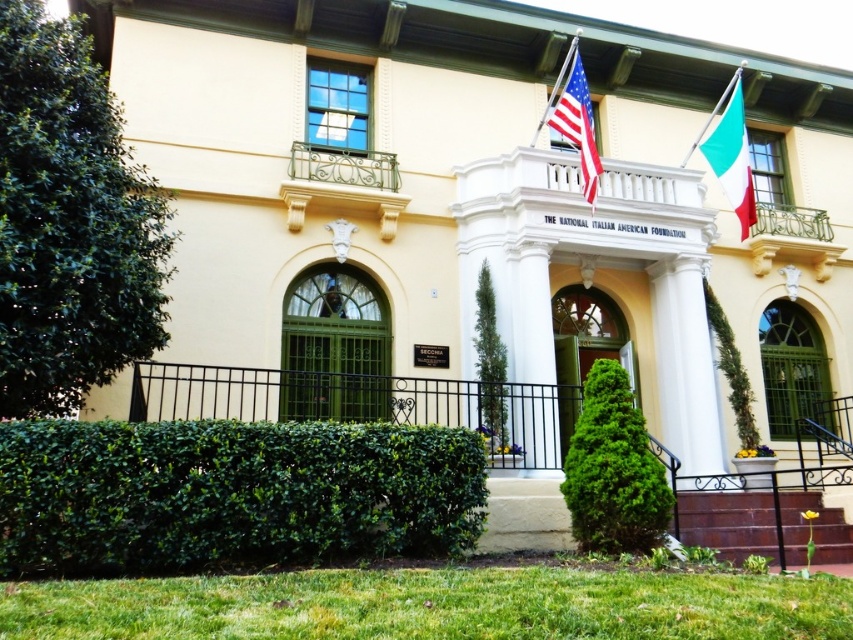
Is green leafy hedge at lower left shorter than brown wooden stairs at lower right?

No.

Between green leafy hedge at lower left and brown wooden stairs at lower right, which one has less height?

brown wooden stairs at lower right

At what (x,y) coordinates should I click in order to perform the action: click on green leafy hedge at lower left. Please return your answer as a coordinate pair (x, y). This screenshot has width=853, height=640. Looking at the image, I should click on (230, 493).

Who is taller, green textured hedge at center or brown wooden stairs at lower right?

green textured hedge at center

In the scene shown: Which is below, green textured hedge at center or brown wooden stairs at lower right?

brown wooden stairs at lower right is below.

What do you see at coordinates (613, 468) in the screenshot? The width and height of the screenshot is (853, 640). I see `green textured hedge at center` at bounding box center [613, 468].

The width and height of the screenshot is (853, 640). What are the coordinates of `green textured hedge at center` in the screenshot? It's located at (613, 468).

Which is below, green fabric flag at upper right or matte white flag at center?

green fabric flag at upper right is lower down.

Does green fabric flag at upper right have a smaller size compared to matte white flag at center?

No, green fabric flag at upper right is not smaller than matte white flag at center.

This screenshot has height=640, width=853. Identify the location of green fabric flag at upper right. (730, 154).